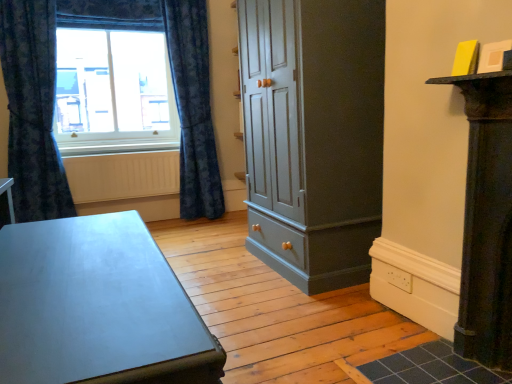
Locate an element on the screen. white textured radiator at lower left is located at coordinates pyautogui.click(x=122, y=176).

At what (x,y) coordinates should I click in order to perform the action: click on matte glass window at upper left. Please return your answer as a coordinate pair (x, y). The image size is (512, 384). Looking at the image, I should click on (114, 92).

Locate an element on the screen. blue textured curtain at left, which is counted as the 1th curtain, starting from the right is located at coordinates (193, 108).

What do you see at coordinates (313, 136) in the screenshot? I see `matte gray cupboard at center` at bounding box center [313, 136].

In order to click on white textured radiator at lower left in this screenshot , I will do `click(122, 176)`.

From the image's perspective, is matte gray table at lower left beneath dark blue textured curtain at left, which is the 1th curtain from left to right?

Correct, matte gray table at lower left appears lower than dark blue textured curtain at left, which is the 1th curtain from left to right, in the image.

Does matte gray table at lower left have a greater height compared to dark blue textured curtain at left, which is the 1th curtain from left to right?

In fact, matte gray table at lower left may be shorter than dark blue textured curtain at left, which is the 1th curtain from left to right.

Is matte gray table at lower left thinner than dark blue textured curtain at left, which appears as the 2th curtain when viewed from the right?

Incorrect, the width of matte gray table at lower left is not less than that of dark blue textured curtain at left, which appears as the 2th curtain when viewed from the right.

Is dark blue textured curtain at left, which is the 1th curtain from left to right, at the back of matte gray table at lower left?

matte gray table at lower left is not turned away from dark blue textured curtain at left, which is the 1th curtain from left to right.

Considering the sizes of objects dark blue textured curtain at left, which is the 1th curtain from left to right, and white textured radiator at lower left in the image provided, who is wider, dark blue textured curtain at left, which is the 1th curtain from left to right, or white textured radiator at lower left?

With larger width is dark blue textured curtain at left, which is the 1th curtain from left to right.

Does point (23, 15) lie behind point (159, 181)?

No, (23, 15) is closer to viewer.

Which of these two, dark blue textured curtain at left, which appears as the 2th curtain when viewed from the right, or white textured radiator at lower left, is bigger?

dark blue textured curtain at left, which appears as the 2th curtain when viewed from the right.

Who is taller, dark blue textured curtain at left, which is the 1th curtain from left to right, or white textured radiator at lower left?

Standing taller between the two is dark blue textured curtain at left, which is the 1th curtain from left to right.

Which is closer, (291,49) or (101,72)?

The point (291,49) is closer.

Considering the positions of objects matte gray cupboard at center and matte glass window at upper left in the image provided, who is more to the left, matte gray cupboard at center or matte glass window at upper left?

Positioned to the left is matte glass window at upper left.

Is matte gray cupboard at center facing away from matte glass window at upper left?

No, matte gray cupboard at center is not facing the opposite direction of matte glass window at upper left.

What's the angular difference between blue textured curtain at left, which is counted as the 1th curtain, starting from the right, and matte glass window at upper left's facing directions?

The angle between the facing direction of blue textured curtain at left, which is counted as the 1th curtain, starting from the right, and the facing direction of matte glass window at upper left is 0.349 degrees.

Is point (200, 178) closer or farther from the camera than point (132, 117)?

Point (200, 178) is closer to the camera than point (132, 117).

Does blue textured curtain at left, which is counted as the 1th curtain, starting from the right, have a lesser width compared to matte glass window at upper left?

No.

Is blue textured curtain at left, the 2th curtain when ordered from left to right, taller or shorter than matte glass window at upper left?

Considering their sizes, blue textured curtain at left, the 2th curtain when ordered from left to right, has more height than matte glass window at upper left.

This screenshot has width=512, height=384. Find the location of `window behind the matte gray cupboard at center`. window behind the matte gray cupboard at center is located at coordinates (114, 92).

Is there a large distance between matte glass window at upper left and matte gray cupboard at center?

Yes, matte glass window at upper left is far from matte gray cupboard at center.

From a real-world perspective, is matte glass window at upper left located beneath matte gray cupboard at center?

No, from a real-world perspective, matte glass window at upper left is not under matte gray cupboard at center.

Is matte gray cupboard at center surrounded by matte glass window at upper left?

No, matte gray cupboard at center is not a part of matte glass window at upper left.

From a real-world perspective, which is physically below, matte gray table at lower left or blue textured curtain at left, which is counted as the 1th curtain, starting from the right?

matte gray table at lower left, from a real-world perspective.

Would you say blue textured curtain at left, the 2th curtain when ordered from left to right, is part of matte gray table at lower left's contents?

No, blue textured curtain at left, the 2th curtain when ordered from left to right, is not a part of matte gray table at lower left.

Between matte gray table at lower left and blue textured curtain at left, the 2th curtain when ordered from left to right, which one has less height?

matte gray table at lower left.

From the image's perspective, is matte gray cupboard at center over blue textured curtain at left, which is counted as the 1th curtain, starting from the right?

No, from the image's perspective, matte gray cupboard at center is not over blue textured curtain at left, which is counted as the 1th curtain, starting from the right.

Is matte gray cupboard at center wider or thinner than blue textured curtain at left, which is counted as the 1th curtain, starting from the right?

In the image, matte gray cupboard at center appears to be wider than blue textured curtain at left, which is counted as the 1th curtain, starting from the right.

Locate an element on the screen. cupboard below the blue textured curtain at left, the 2th curtain when ordered from left to right (from the image's perspective) is located at coordinates (313, 136).

From the picture: Is matte gray cupboard at center located outside blue textured curtain at left, the 2th curtain when ordered from left to right?

That's correct, matte gray cupboard at center is outside of blue textured curtain at left, the 2th curtain when ordered from left to right.

This screenshot has height=384, width=512. Identify the location of table directly beneath the dark blue textured curtain at left, which appears as the 2th curtain when viewed from the right (from a real-world perspective). (97, 307).

What are the coordinates of `radiator behind the dark blue textured curtain at left, which is the 1th curtain from left to right` in the screenshot? It's located at (122, 176).

Based on their spatial positions, is matte gray table at lower left or dark blue textured curtain at left, which is the 1th curtain from left to right, further from matte gray cupboard at center?

The object further to matte gray cupboard at center is dark blue textured curtain at left, which is the 1th curtain from left to right.

When comparing their distances from dark blue textured curtain at left, which appears as the 2th curtain when viewed from the right, does matte gray table at lower left or matte glass window at upper left seem further?

matte gray table at lower left lies further to dark blue textured curtain at left, which appears as the 2th curtain when viewed from the right, than the other object.

Considering their positions, is blue textured curtain at left, the 2th curtain when ordered from left to right, positioned further to dark blue textured curtain at left, which appears as the 2th curtain when viewed from the right, than matte gray cupboard at center?

matte gray cupboard at center.

When comparing their distances from matte gray table at lower left, does blue textured curtain at left, the 2th curtain when ordered from left to right, or white textured radiator at lower left seem closer?

white textured radiator at lower left lies closer to matte gray table at lower left than the other object.

Which object lies further to the anchor point blue textured curtain at left, which is counted as the 1th curtain, starting from the right, matte gray table at lower left or dark blue textured curtain at left, which is the 1th curtain from left to right?

The object further to blue textured curtain at left, which is counted as the 1th curtain, starting from the right, is matte gray table at lower left.

From the image, which object appears to be nearer to white textured radiator at lower left, matte glass window at upper left or matte gray cupboard at center?

Among the two, matte glass window at upper left is located nearer to white textured radiator at lower left.

Estimate the real-world distances between objects in this image. Which object is closer to matte gray cupboard at center, dark blue textured curtain at left, which is the 1th curtain from left to right, or blue textured curtain at left, the 2th curtain when ordered from left to right?

blue textured curtain at left, the 2th curtain when ordered from left to right, lies closer to matte gray cupboard at center than the other object.

From the image, which object appears to be farther from blue textured curtain at left, the 2th curtain when ordered from left to right, matte gray cupboard at center or matte gray table at lower left?

Based on the image, matte gray table at lower left appears to be further to blue textured curtain at left, the 2th curtain when ordered from left to right.

Identify the location of curtain situated between dark blue textured curtain at left, which appears as the 2th curtain when viewed from the right, and matte gray cupboard at center from left to right. The image size is (512, 384). (193, 108).

What are the coordinates of `window between dark blue textured curtain at left, which is the 1th curtain from left to right, and blue textured curtain at left, which is counted as the 1th curtain, starting from the right, from left to right` in the screenshot? It's located at (114, 92).

What are the coordinates of `window between dark blue textured curtain at left, which appears as the 2th curtain when viewed from the right, and matte gray cupboard at center from left to right` in the screenshot? It's located at (114, 92).

You are a GUI agent. You are given a task and a screenshot of the screen. Output one action in this format:
    pyautogui.click(x=<x>, y=<y>)
    Task: Click on the curtain between matte gray table at lower left and blue textured curtain at left, the 2th curtain when ordered from left to right, from front to back
    Image resolution: width=512 pixels, height=384 pixels.
    Given the screenshot: What is the action you would take?
    pyautogui.click(x=32, y=110)